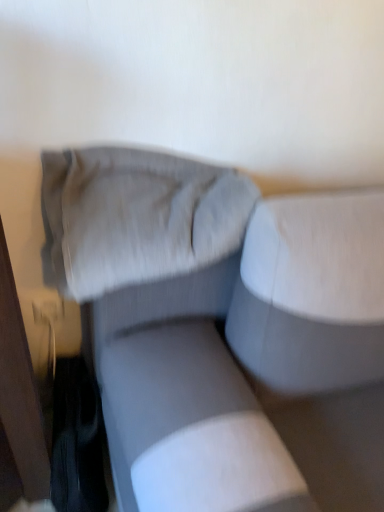
Question: Looking at the image, does suede-like gray pillow at upper center seem bigger or smaller compared to textured gray couch at center?

Choices:
 (A) big
 (B) small

Answer: (B)

Question: Is suede-like gray pillow at upper center taller or shorter than textured gray couch at center?

Choices:
 (A) tall
 (B) short

Answer: (B)

Question: Relative to textured gray couch at center, is suede-like gray pillow at upper center in front or behind?

Choices:
 (A) front
 (B) behind

Answer: (B)

Question: From the image's perspective, relative to suede-like gray pillow at upper center, is textured gray couch at center above or below?

Choices:
 (A) below
 (B) above

Answer: (A)

Question: Is textured gray couch at center taller or shorter than suede-like gray pillow at upper center?

Choices:
 (A) short
 (B) tall

Answer: (B)

Question: In the image, is textured gray couch at center positioned in front of or behind suede-like gray pillow at upper center?

Choices:
 (A) behind
 (B) front

Answer: (B)

Question: Is textured gray couch at center to the left or to the right of suede-like gray pillow at upper center in the image?

Choices:
 (A) left
 (B) right

Answer: (B)